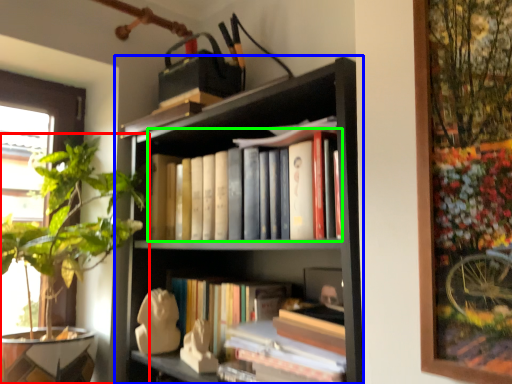
Question: Which is nearer to the houseplant (highlighted by a red box)? bookcase (highlighted by a blue box) or book (highlighted by a green box).

Choices:
 (A) bookcase
 (B) book

Answer: (B)